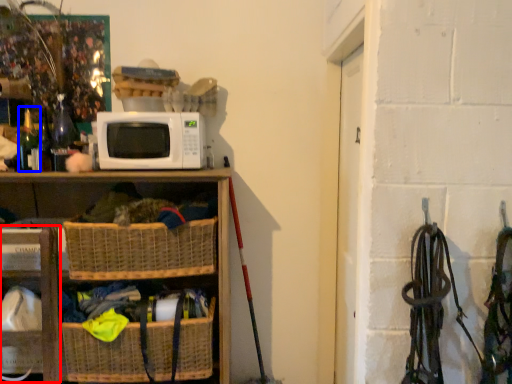
Question: Which object appears farthest to the camera in this image, shelf (highlighted by a red box) or bottle (highlighted by a blue box)?

Choices:
 (A) shelf
 (B) bottle

Answer: (B)